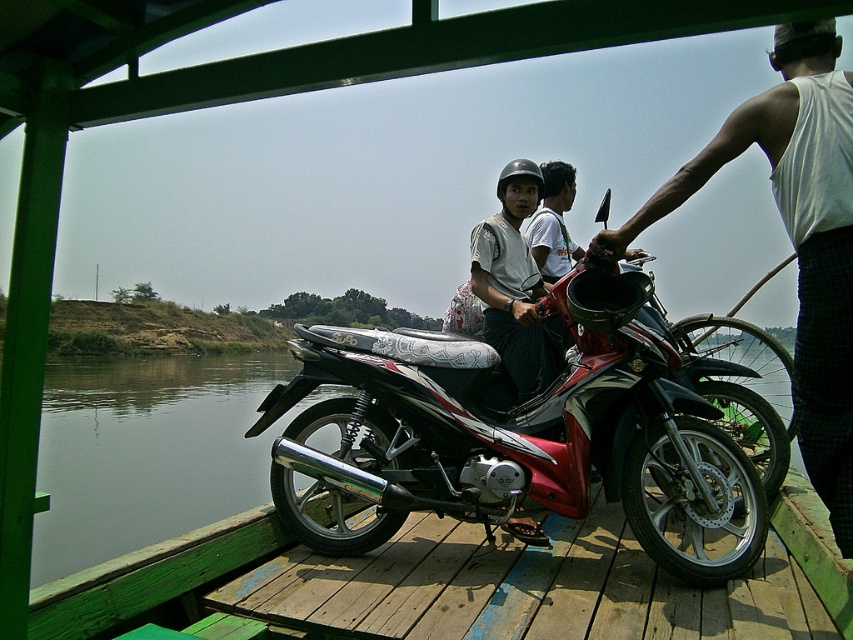
Is shiny red motorcycle at center to the left of white tank top at right from the viewer's perspective?

Indeed, shiny red motorcycle at center is positioned on the left side of white tank top at right.

Does shiny red motorcycle at center come behind white tank top at right?

That is True.

Where is `shiny red motorcycle at center`? This screenshot has width=853, height=640. shiny red motorcycle at center is located at coordinates (515, 436).

The width and height of the screenshot is (853, 640). Identify the location of shiny red motorcycle at center. (515, 436).

Can you confirm if shiny red motorcycle at center is shorter than white shirt at center?

Incorrect, shiny red motorcycle at center's height does not fall short of white shirt at center's.

The height and width of the screenshot is (640, 853). What do you see at coordinates (515, 436) in the screenshot? I see `shiny red motorcycle at center` at bounding box center [515, 436].

Where is `shiny red motorcycle at center`? The height and width of the screenshot is (640, 853). shiny red motorcycle at center is located at coordinates (515, 436).

Is shiny red motorcycle at center further to the viewer compared to matte white shirt at center?

That is False.

In order to click on shiny red motorcycle at center in this screenshot , I will do `click(515, 436)`.

Where is `shiny red motorcycle at center`? This screenshot has height=640, width=853. shiny red motorcycle at center is located at coordinates (515, 436).